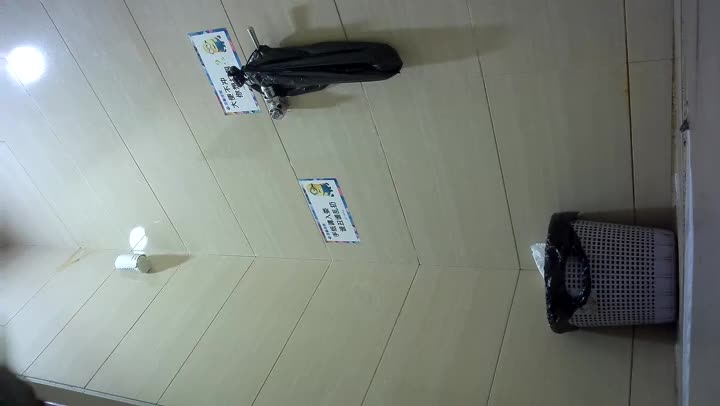
Locate an element on the screen. light is located at coordinates (34, 59), (139, 255).